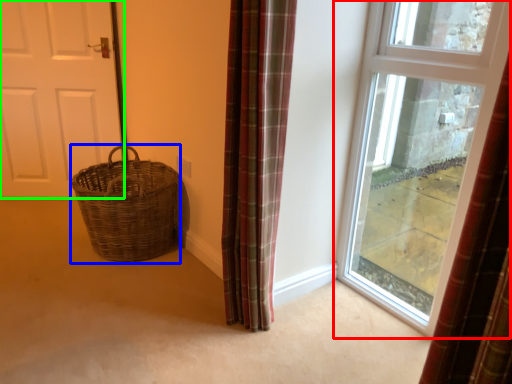
Question: Based on their relative distances, which object is nearer to window (highlighted by a red box)? Choose from basket (highlighted by a blue box) and door (highlighted by a green box).

Choices:
 (A) basket
 (B) door

Answer: (A)